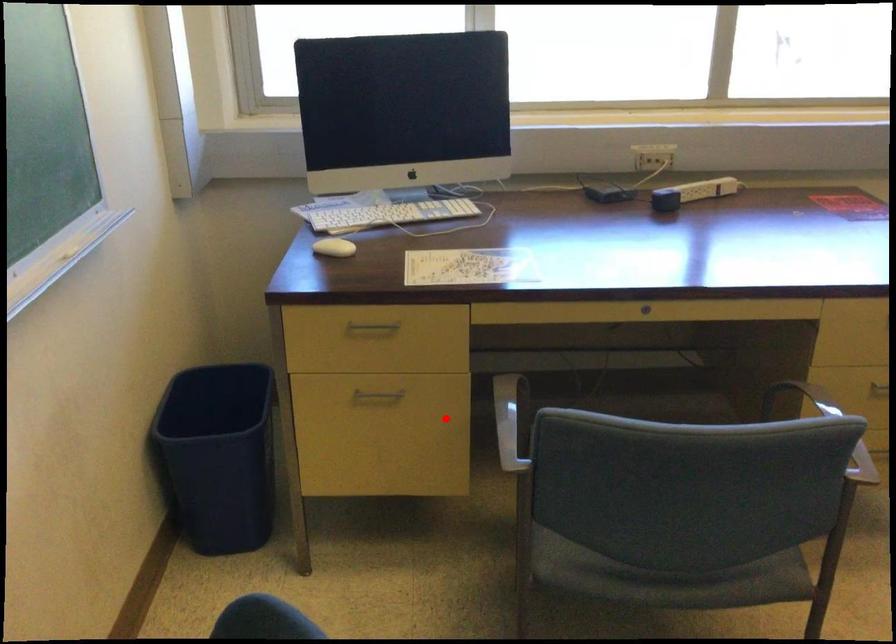
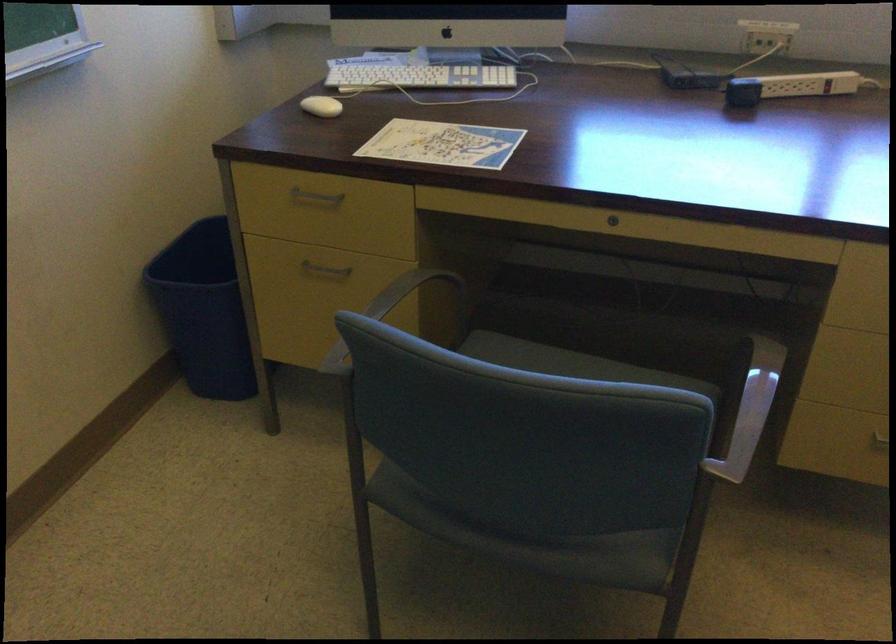
Where in the second image is the point corresponding to the highlighted location from the first image?

(393, 308)